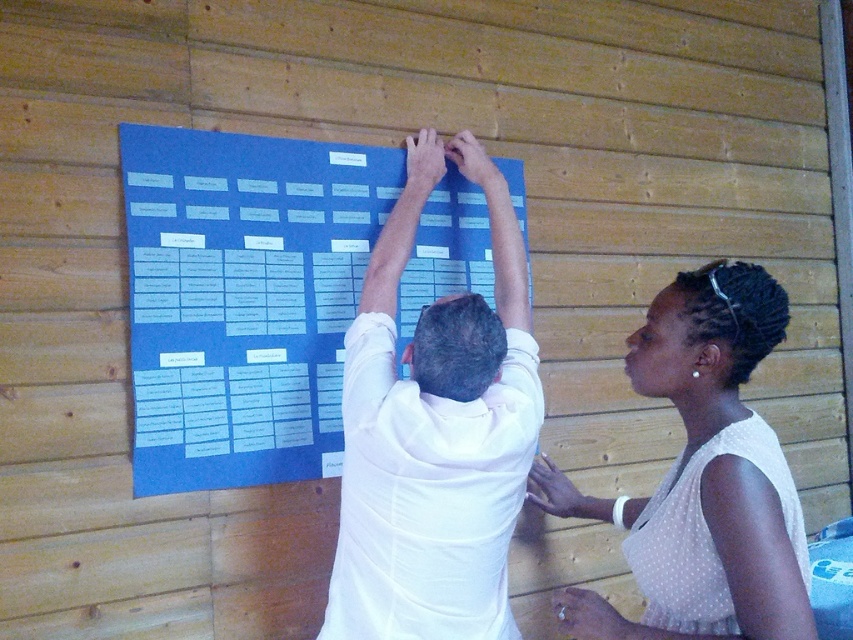
Which is above, blue paperboard at center or white dotted blouse at upper right?

Positioned higher is blue paperboard at center.

Is blue paperboard at center to the left of white dotted blouse at upper right from the viewer's perspective?

Correct, you'll find blue paperboard at center to the left of white dotted blouse at upper right.

Is point (225, 410) closer to viewer compared to point (608, 605)?

No, (225, 410) is behind (608, 605).

At what (x,y) coordinates should I click in order to perform the action: click on blue paperboard at center. Please return your answer as a coordinate pair (x, y). The image size is (853, 640). Looking at the image, I should click on (242, 300).

Which is behind, point (448, 141) or point (695, 580)?

Positioned behind is point (448, 141).

Who is lower down, white matte shirt at center or white dotted blouse at upper right?

white dotted blouse at upper right

Where is `white matte shirt at center`? This screenshot has height=640, width=853. white matte shirt at center is located at coordinates (434, 432).

Who is taller, blue paperboard at center or white matte shirt at center?

white matte shirt at center is taller.

Is point (183, 168) more distant than point (366, 634)?

Yes, it is.

This screenshot has height=640, width=853. I want to click on blue paperboard at center, so click(242, 300).